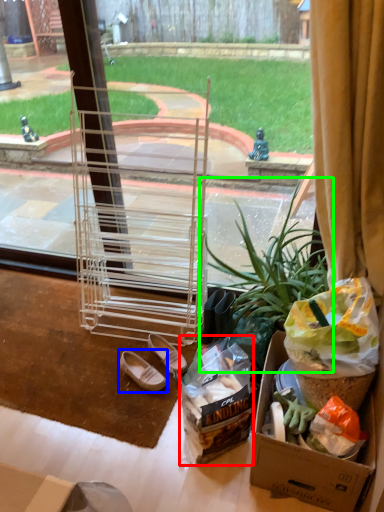
Question: Which is nearer to the waste (highlighted by a red box)? footwear (highlighted by a blue box) or houseplant (highlighted by a green box).

Choices:
 (A) footwear
 (B) houseplant

Answer: (B)